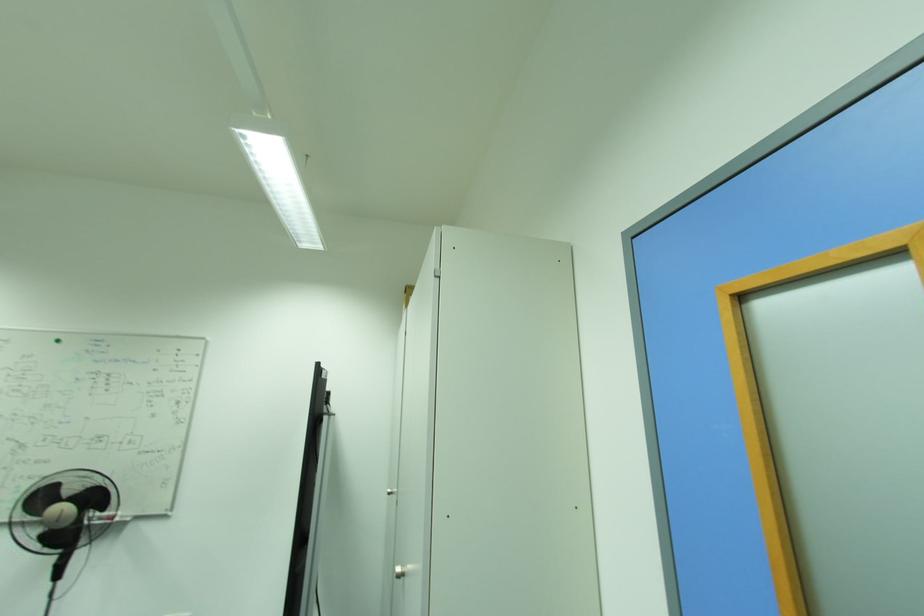
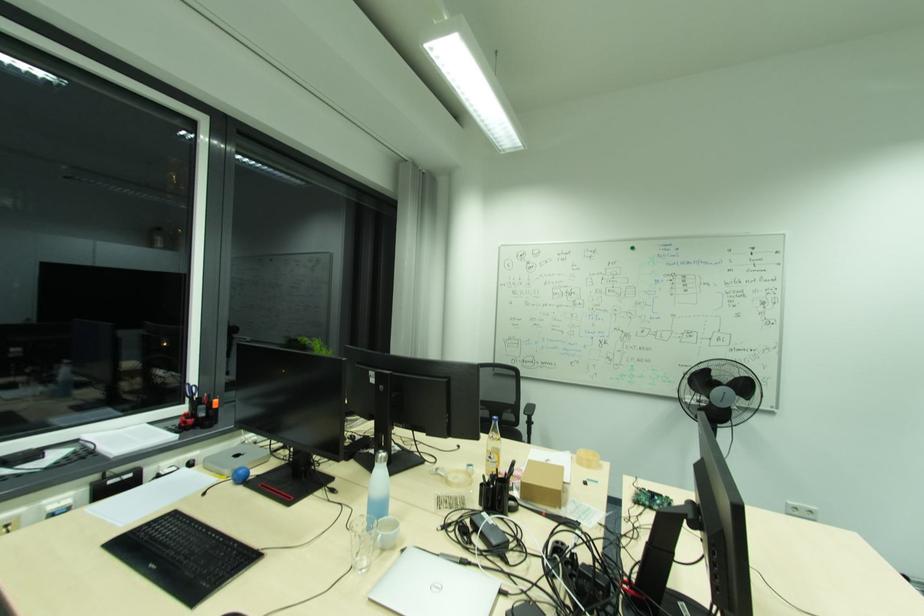
Locate, in the second image, the point that corresponds to [101,496] in the first image.

(748, 387)